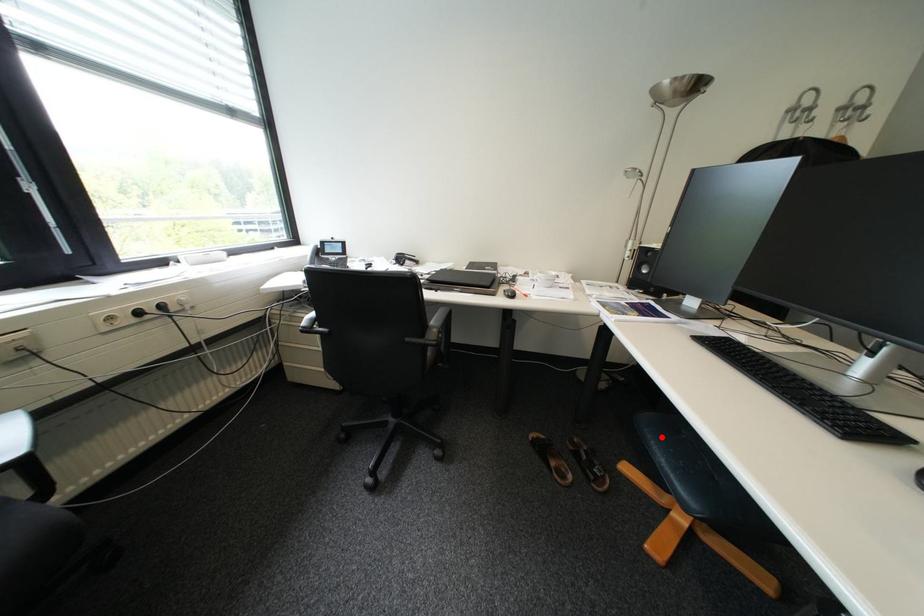
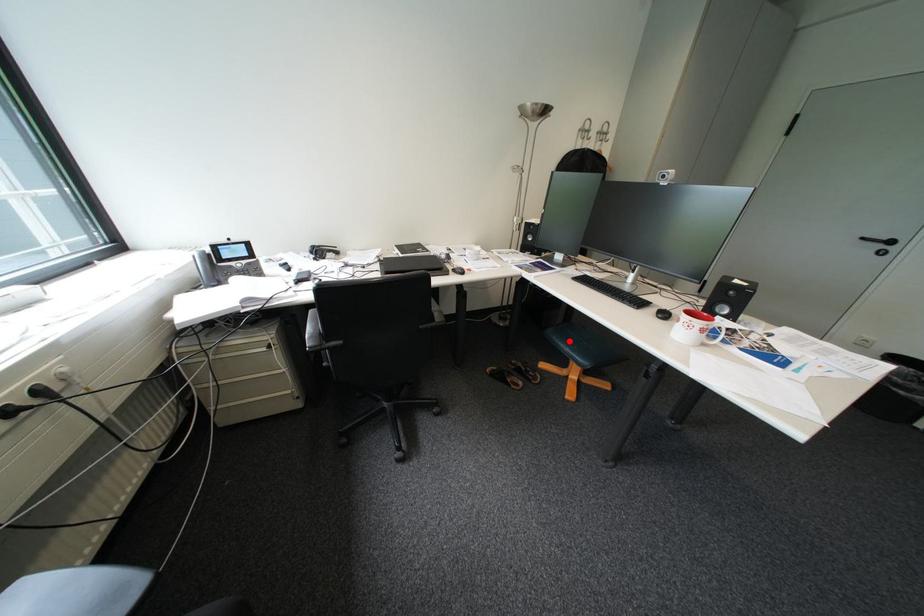
I am providing you with two images of the same scene from different viewpoints. A red point is marked on the first image and another point is marked on the second image. Is the red point in image1 aligned with the point shown in image2?

Yes